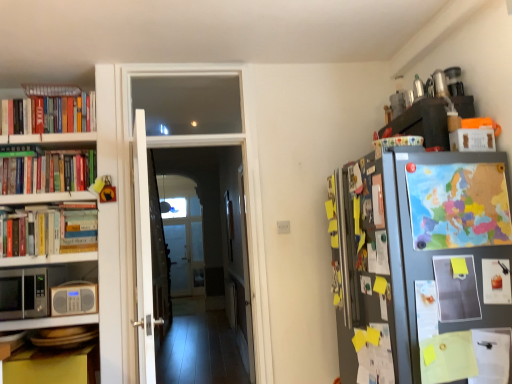
Where is `free space above hardcover books at left, the 2th book when ordered from back to front (from a real-world perspective)`? free space above hardcover books at left, the 2th book when ordered from back to front (from a real-world perspective) is located at coordinates (44, 141).